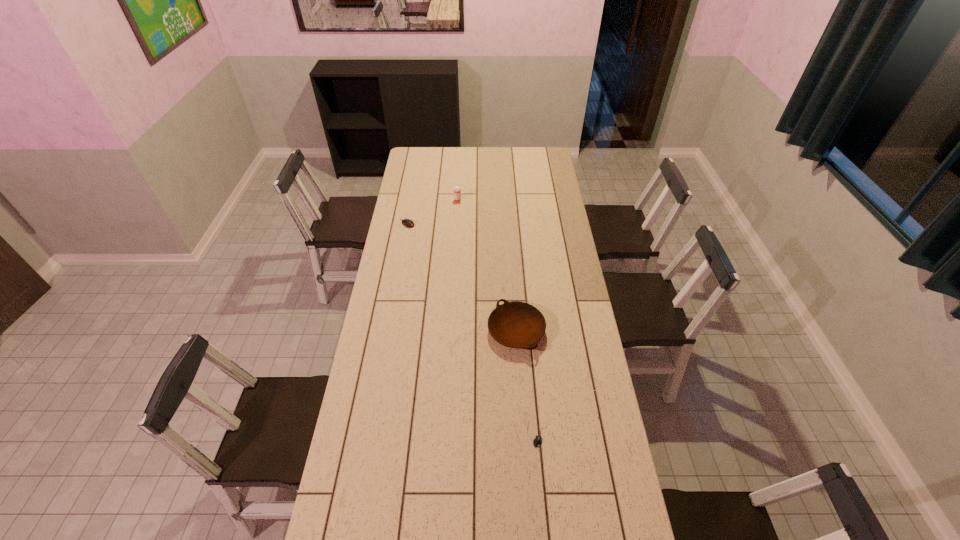
Where is `free location located 0.150m on the right of the left mouse`? free location located 0.150m on the right of the left mouse is located at coordinates (444, 224).

The height and width of the screenshot is (540, 960). Identify the location of vacant space situated 0.230m on the left of the nearest object. (465, 436).

Where is `object that is at the left edge`? The image size is (960, 540). object that is at the left edge is located at coordinates (408, 223).

Find the location of `vacant area at the far edge`. vacant area at the far edge is located at coordinates (483, 156).

Find the location of `vacant space at the left edge of the desktop`. vacant space at the left edge of the desktop is located at coordinates (417, 269).

Locate an element on the screen. This screenshot has width=960, height=540. free location at the right edge is located at coordinates (563, 240).

I want to click on free space that is in between the nearer mouse and the left mouse, so click(x=474, y=330).

In order to click on blank region between the farthest object and the second nearest object in this screenshot , I will do `click(487, 266)`.

The height and width of the screenshot is (540, 960). Identify the location of vacant space that's between the shorter mouse and the taller mouse. (474, 330).

Where is `free space between the plate and the nearest object`? The width and height of the screenshot is (960, 540). free space between the plate and the nearest object is located at coordinates (528, 383).